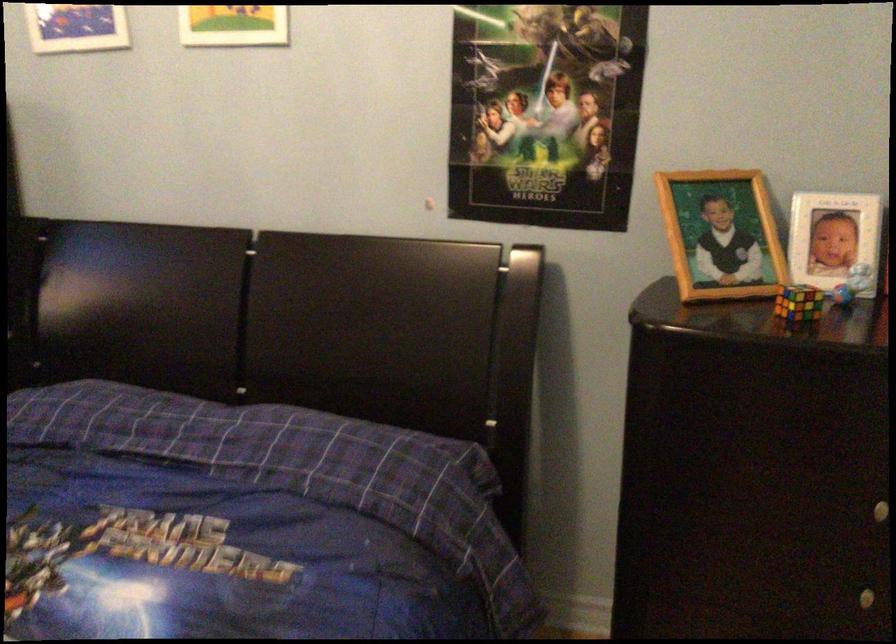
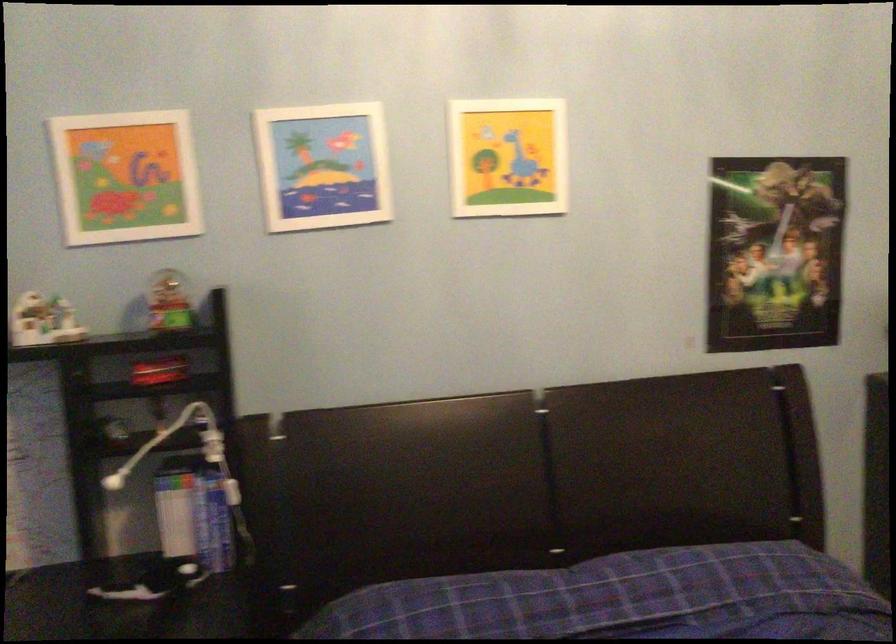
Question: In a continuous first-person perspective shot, in which direction is the camera moving?

Choices:
 (A) Left
 (B) Right
 (C) Forward
 (D) Backward

Answer: (A)